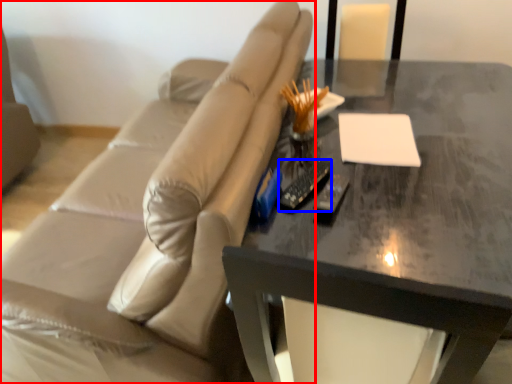
Question: Which object appears farthest to the camera in this image, studio couch (highlighted by a red box) or remote (highlighted by a blue box)?

Choices:
 (A) studio couch
 (B) remote

Answer: (B)